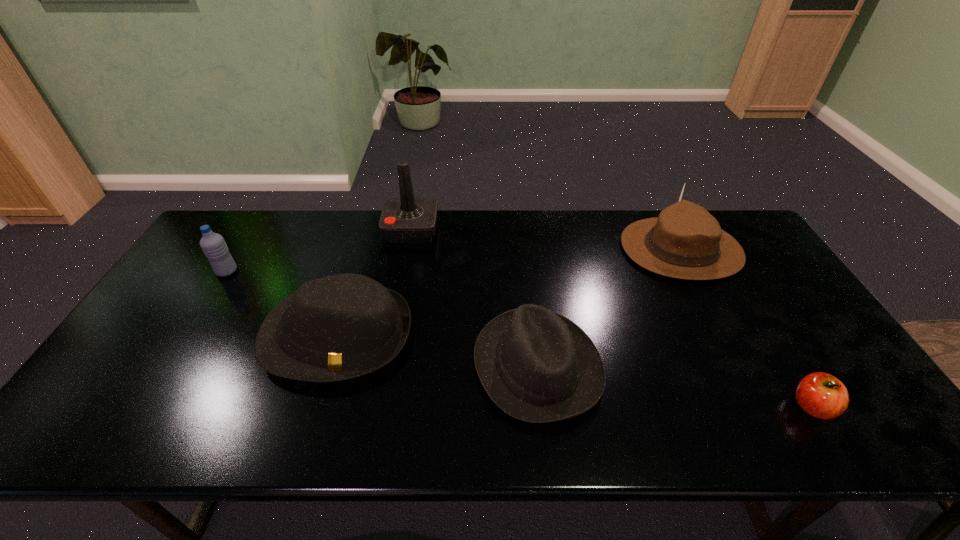
Identify the location of fedora that is positioned at the right edge. (686, 242).

Image resolution: width=960 pixels, height=540 pixels. I want to click on apple positioned at the right edge, so click(821, 395).

You are a GUI agent. You are given a task and a screenshot of the screen. Output one action in this format:
    pyautogui.click(x=<x>, y=<y>)
    Task: Click on the object that is at the far right corner
    
    Given the screenshot: What is the action you would take?
    click(x=686, y=242)

Identify the location of object that is at the near right corner. (821, 395).

Find the location of a particular element. The image size is (960, 540). free space at the far edge of the desktop is located at coordinates (468, 250).

Identify the location of vacant space at the near edge of the desktop. The height and width of the screenshot is (540, 960). (454, 422).

In order to click on free point at the left edge in this screenshot , I will do `click(236, 258)`.

What are the coordinates of `free space at the right edge of the desktop` in the screenshot? It's located at (769, 260).

This screenshot has height=540, width=960. Identify the location of free space at the far left corner. (241, 226).

In the image, there is a desktop. Where is `vacant space at the near left corner`? This screenshot has height=540, width=960. vacant space at the near left corner is located at coordinates (62, 436).